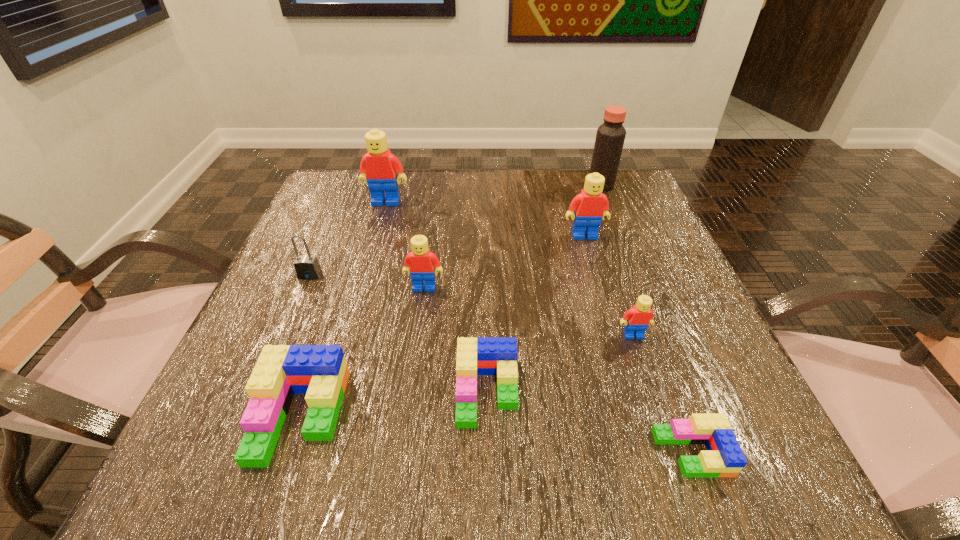
At what (x,y) coordinates should I click in order to perform the action: click on the farthest object. Please return your answer as a coordinate pair (x, y). This screenshot has height=540, width=960. Looking at the image, I should click on (610, 137).

Find the location of `brown vinegar`. brown vinegar is located at coordinates (610, 137).

At what (x,y) coordinates should I click in order to perform the action: click on the farthest Lego. Please return your answer as a coordinate pair (x, y). The width and height of the screenshot is (960, 540). Looking at the image, I should click on (379, 168).

This screenshot has height=540, width=960. Identify the location of the leftmost red Lego. (379, 168).

Where is `the second farthest Lego`? This screenshot has width=960, height=540. the second farthest Lego is located at coordinates (x=591, y=205).

The width and height of the screenshot is (960, 540). What are the coordinates of `the sixth shortest Lego` in the screenshot? It's located at (591, 205).

Find the location of a particular element. the sixth shortest object is located at coordinates (422, 261).

This screenshot has height=540, width=960. In order to click on the sixth object from right to left in this screenshot , I will do `click(422, 261)`.

Locate an element on the screen. gray padlock is located at coordinates (307, 267).

The image size is (960, 540). What are the coordinates of `the fourth farthest object` in the screenshot? It's located at (307, 267).